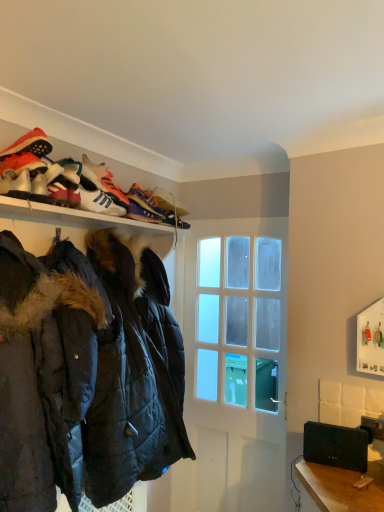
Question: Does multicolored fabric shoe at upper center, which is the 2th shoe from front to back, come behind white leather sneakers at upper center, marked as the 2th shoe in a back-to-front arrangement?

Choices:
 (A) yes
 (B) no

Answer: (A)

Question: Considering the relative sizes of multicolored fabric shoe at upper center, which ranks as the first shoe in back-to-front order, and white leather sneakers at upper center, marked as the 2th shoe in a back-to-front arrangement, in the image provided, is multicolored fabric shoe at upper center, which ranks as the first shoe in back-to-front order, shorter than white leather sneakers at upper center, marked as the 2th shoe in a back-to-front arrangement,?

Choices:
 (A) no
 (B) yes

Answer: (A)

Question: Are multicolored fabric shoe at upper center, which ranks as the first shoe in back-to-front order, and white leather sneakers at upper center, marked as the 2th shoe in a back-to-front arrangement, located far from each other?

Choices:
 (A) no
 (B) yes

Answer: (A)

Question: From a real-world perspective, is multicolored fabric shoe at upper center, which ranks as the first shoe in back-to-front order, positioned under white leather sneakers at upper center, marked as the 2th shoe in a back-to-front arrangement, based on gravity?

Choices:
 (A) yes
 (B) no

Answer: (B)

Question: Is multicolored fabric shoe at upper center, which is the 2th shoe from front to back, thinner than white leather sneakers at upper center, the 1th shoe positioned from the front?

Choices:
 (A) yes
 (B) no

Answer: (B)

Question: Can you confirm if multicolored fabric shoe at upper center, which ranks as the first shoe in back-to-front order, is positioned to the left of white leather sneakers at upper center, marked as the 2th shoe in a back-to-front arrangement?

Choices:
 (A) yes
 (B) no

Answer: (B)

Question: Is white leather sneakers at upper left, arranged as the 1th footwear when viewed from the front, not within dark blue quilted jacket at left?

Choices:
 (A) yes
 (B) no

Answer: (A)

Question: From the image's perspective, does white leather sneakers at upper left, arranged as the 1th footwear when viewed from the front, appear lower than dark blue quilted jacket at left?

Choices:
 (A) yes
 (B) no

Answer: (B)

Question: From the image's perspective, is white leather sneakers at upper left, arranged as the 1th footwear when viewed from the front, on top of dark blue quilted jacket at left?

Choices:
 (A) no
 (B) yes

Answer: (B)

Question: Would you say dark blue quilted jacket at left is part of white leather sneakers at upper left, arranged as the 1th footwear when viewed from the front,'s contents?

Choices:
 (A) yes
 (B) no

Answer: (B)

Question: Is white leather sneakers at upper left, which is the fourth footwear from back to front, directly adjacent to dark blue quilted jacket at left?

Choices:
 (A) yes
 (B) no

Answer: (B)

Question: Can you confirm if white leather sneakers at upper left, arranged as the 1th footwear when viewed from the front, is positioned to the right of dark blue quilted jacket at left?

Choices:
 (A) no
 (B) yes

Answer: (A)

Question: Does multicolored fabric shoe at upper center, which is the 2th shoe from front to back, turn towards dark blue quilted jacket at left?

Choices:
 (A) no
 (B) yes

Answer: (A)